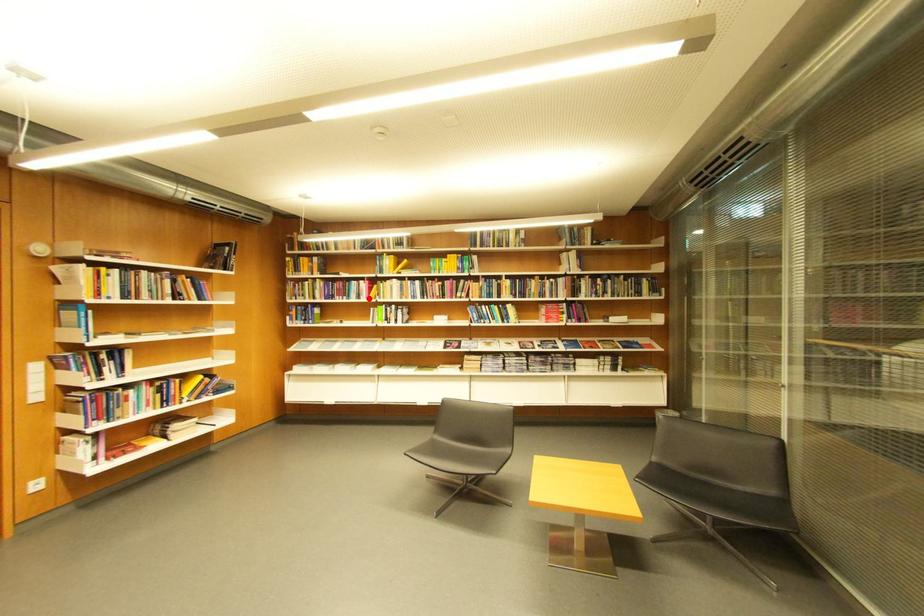
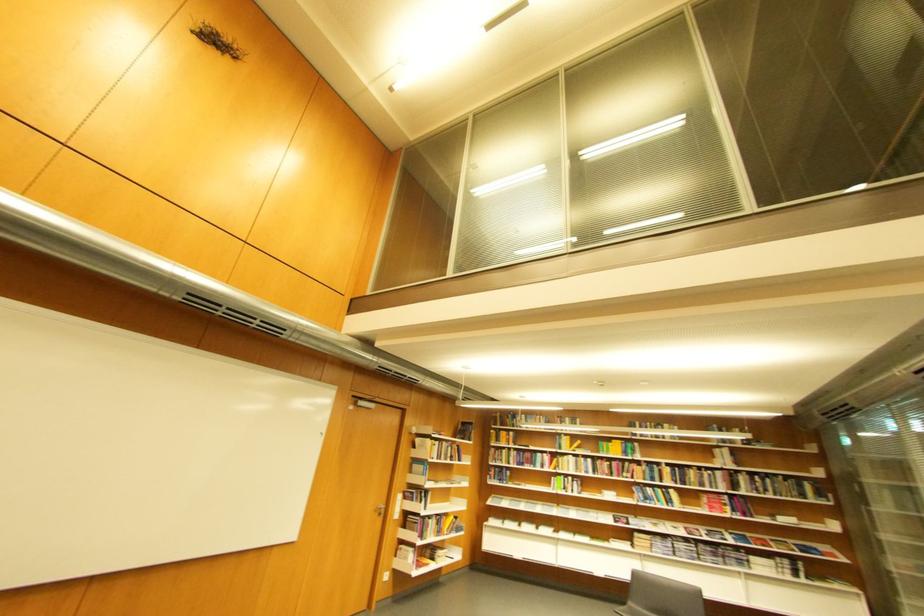
Question: I am providing you with two images of the same scene from different viewpoints. In image1, a red point is highlighted. Considering the same 3D point in image2, which of the following is correct?

Choices:
 (A) It is closer
 (B) It is farther

Answer: (B)